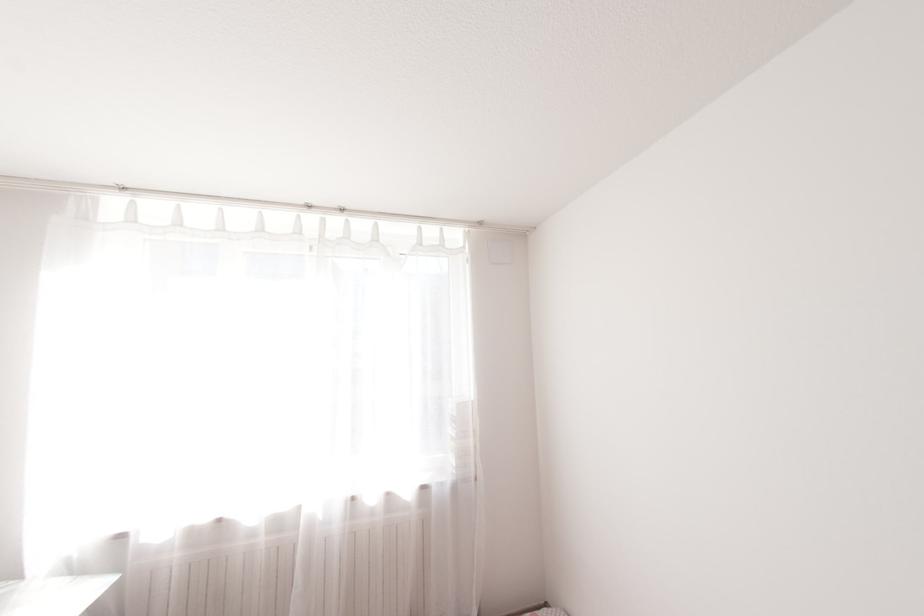
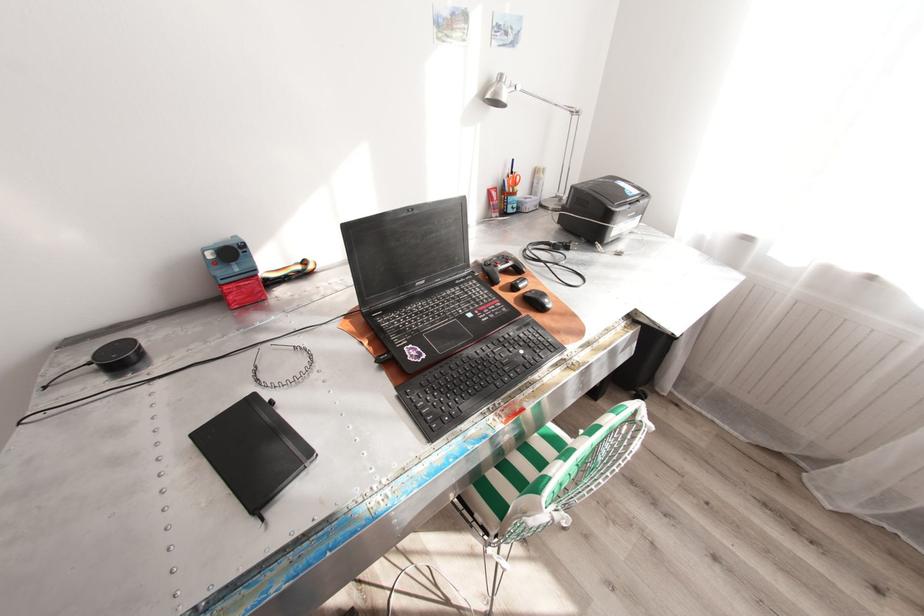
The images are taken continuously from a first-person perspective. In which direction is your viewpoint rotating?

The camera rotated toward left-down.